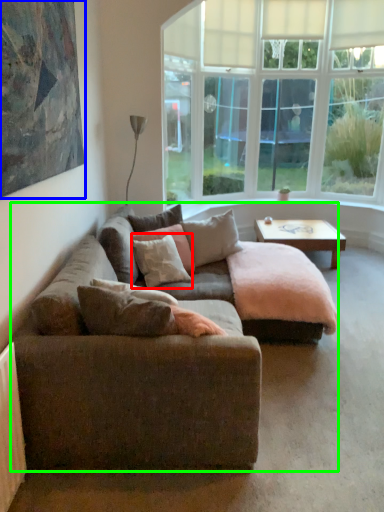
Question: Which is nearer to the pillow (highlighted by a red box)? picture frame (highlighted by a blue box) or studio couch (highlighted by a green box).

Choices:
 (A) picture frame
 (B) studio couch

Answer: (B)